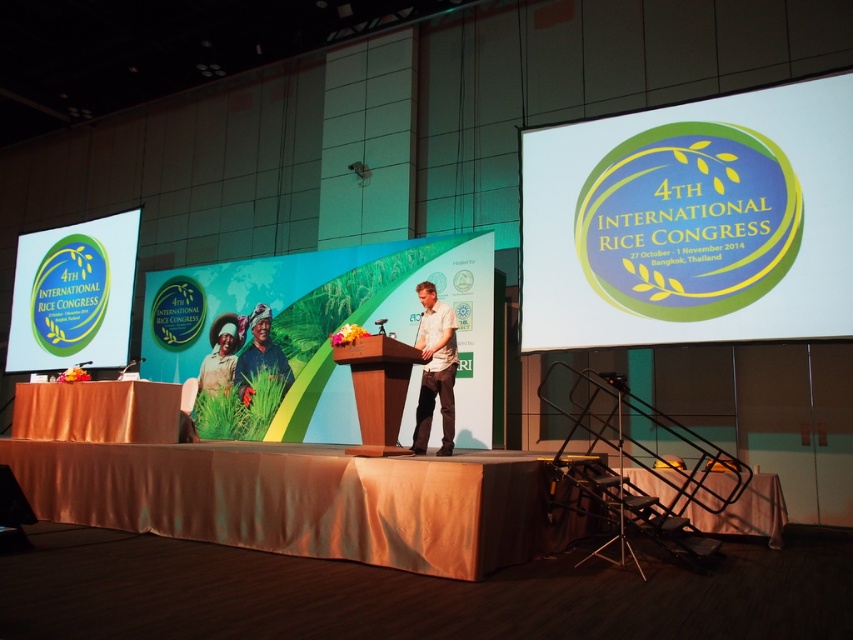
In the scene shown: You are an attendee at the 4th International Rice Congress and you want to take a photo of the speaker standing behind the orange fabric table at center and the white cotton shirt at center. Which object should you focus on first to ensure both are in frame?

You should focus on the orange fabric table at center first since it is closer to the viewer than the white cotton shirt at center, ensuring both are in frame by adjusting the camera angle accordingly.

You are a photographer positioned at the back of the stage. You need to capture a photo of the metallic silver table at center and the matte black shirt at center. What is the minimum distance you need to cover to ensure both objects are in frame?

The metallic silver table at center is 4.80 meters away from the matte black shirt at center. To capture both in frame, you need to position yourself at least 4.80 meters away from the closest object, ensuring both are within the camera view.

You are an event organizer who needs to adjust the microphone height for both the orange fabric table at center and the metallic silver table at center. Which table requires a taller microphone stand?

The orange fabric table at center is much taller than the metallic silver table at center, so the orange fabric table at center requires a taller microphone stand.